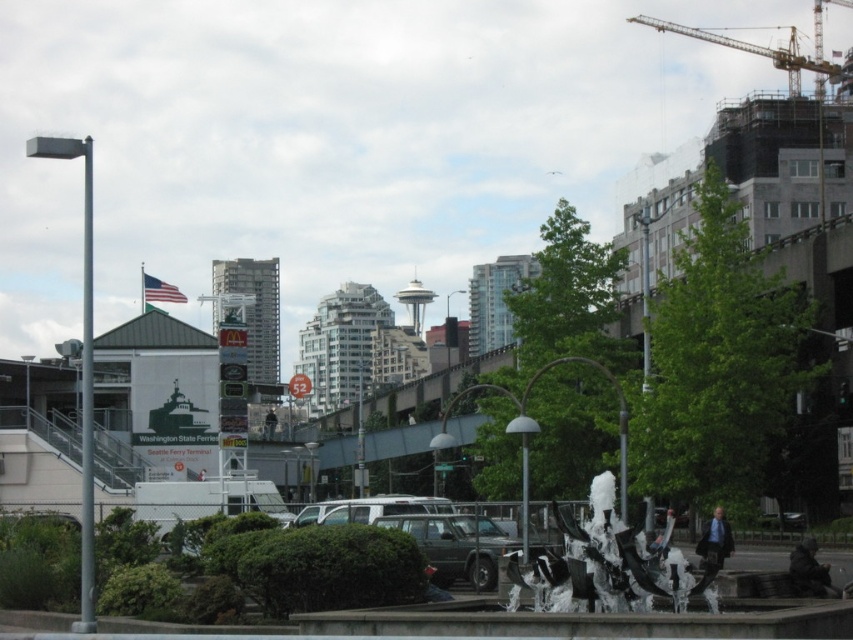
Which is above, metallic gray suv at center or metallic construction crane at upper right?

metallic construction crane at upper right is above.

Is point (474, 554) positioned in front of point (776, 67)?

That is True.

Where is `metallic gray suv at center`? This screenshot has width=853, height=640. metallic gray suv at center is located at coordinates (456, 545).

Does white frothy sculpture at center appear on the right side of metallic gray suv at center?

Correct, you'll find white frothy sculpture at center to the right of metallic gray suv at center.

Can you confirm if white frothy sculpture at center is positioned below metallic gray suv at center?

No, white frothy sculpture at center is not below metallic gray suv at center.

I want to click on white frothy sculpture at center, so click(x=606, y=563).

Consider the image. Does white frothy sculpture at center have a lesser height compared to metallic construction crane at upper right?

Yes.

Which is more to the right, white frothy sculpture at center or metallic construction crane at upper right?

metallic construction crane at upper right is more to the right.

This screenshot has width=853, height=640. Describe the element at coordinates (606, 563) in the screenshot. I see `white frothy sculpture at center` at that location.

Locate an element on the screen. The image size is (853, 640). white frothy sculpture at center is located at coordinates (606, 563).